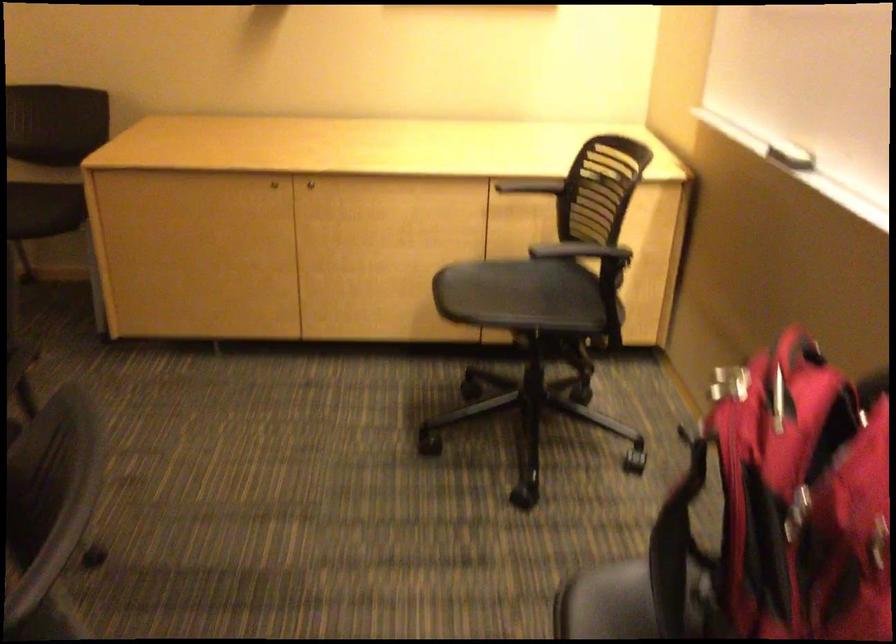
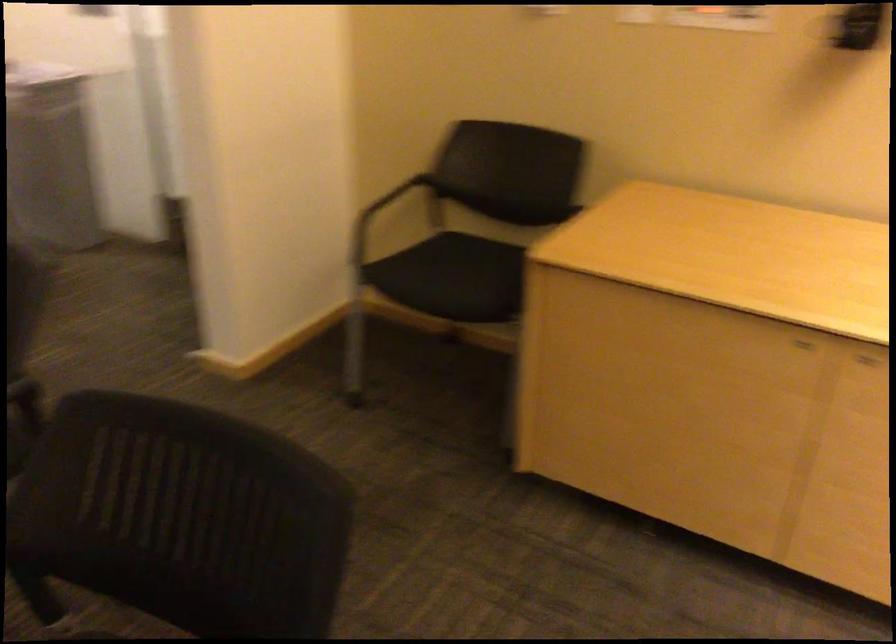
Question: Based on the continuous images, in which direction is the camera rotating? Reply with the corresponding letter.

Choices:
 (A) Left
 (B) Right
 (C) Up
 (D) Down

Answer: (A)